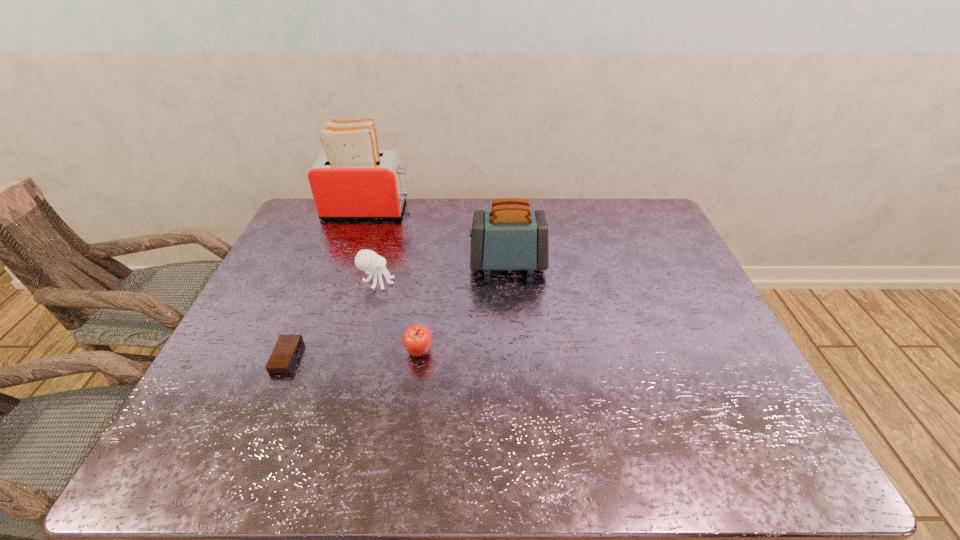
Where is `the taller toaster`? Image resolution: width=960 pixels, height=540 pixels. the taller toaster is located at coordinates (350, 179).

In order to click on the tallest object in this screenshot , I will do `click(350, 179)`.

The image size is (960, 540). I want to click on the shorter toaster, so click(510, 236).

You are a GUI agent. You are given a task and a screenshot of the screen. Output one action in this format:
    pyautogui.click(x=<x>, y=<y>)
    Task: Click on the right toaster
    The image size is (960, 540).
    Given the screenshot: What is the action you would take?
    pyautogui.click(x=510, y=236)

Image resolution: width=960 pixels, height=540 pixels. I want to click on the third tallest object, so click(x=366, y=260).

The width and height of the screenshot is (960, 540). What are the coordinates of `the second object from right to left` in the screenshot? It's located at (417, 339).

Image resolution: width=960 pixels, height=540 pixels. I want to click on apple, so click(x=417, y=339).

The width and height of the screenshot is (960, 540). I want to click on the shortest object, so (x=283, y=357).

You are a GUI agent. You are given a task and a screenshot of the screen. Output one action in this format:
    pyautogui.click(x=<x>, y=<y>)
    Task: Click on the vacant space located on the front-facing side of the taller toaster
    The image size is (960, 540).
    Given the screenshot: What is the action you would take?
    pyautogui.click(x=521, y=209)

The image size is (960, 540). Find the location of `vacant space located on the front-facing side of the nearer toaster`. vacant space located on the front-facing side of the nearer toaster is located at coordinates (447, 264).